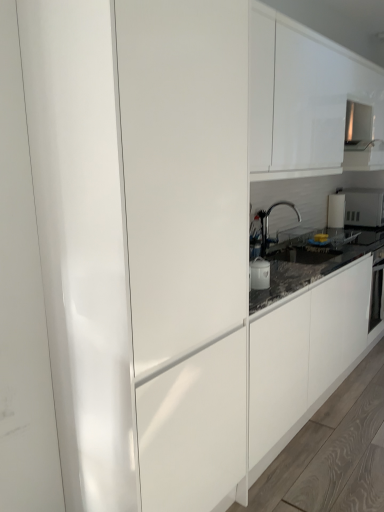
Question: From a real-world perspective, relative to white glossy pot at center, which is the 1th appliance from front to back, is matte white cabinet at center vertically above or below?

Choices:
 (A) below
 (B) above

Answer: (B)

Question: Considering their positions, is matte white cabinet at center located in front of or behind white glossy pot at center, marked as the 1th appliance in a left-to-right arrangement?

Choices:
 (A) front
 (B) behind

Answer: (A)

Question: Which of these objects is positioned closest to the satin nickel faucet at center?

Choices:
 (A) white glossy cabinet at upper center
 (B) white glossy microwave at upper right, which is counted as the first appliance, starting from the top
 (C) matte white cabinet at center
 (D) white glossy pot at center, the 2th appliance when ordered from back to front

Answer: (D)

Question: Which object is the closest to the satin nickel faucet at center?

Choices:
 (A) matte white cabinet at center
 (B) white glossy pot at center, placed as the 2th appliance when sorted from top to bottom
 (C) white glossy microwave at upper right, which is counted as the first appliance, starting from the top
 (D) white glossy cabinet at upper center

Answer: (B)